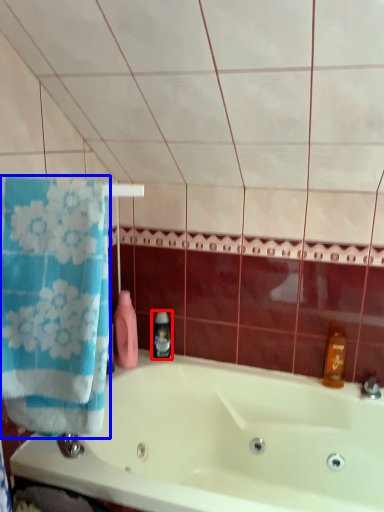
Question: Which object appears farthest to the camera in this image, soap dispenser (highlighted by a red box) or towel (highlighted by a blue box)?

Choices:
 (A) soap dispenser
 (B) towel

Answer: (A)